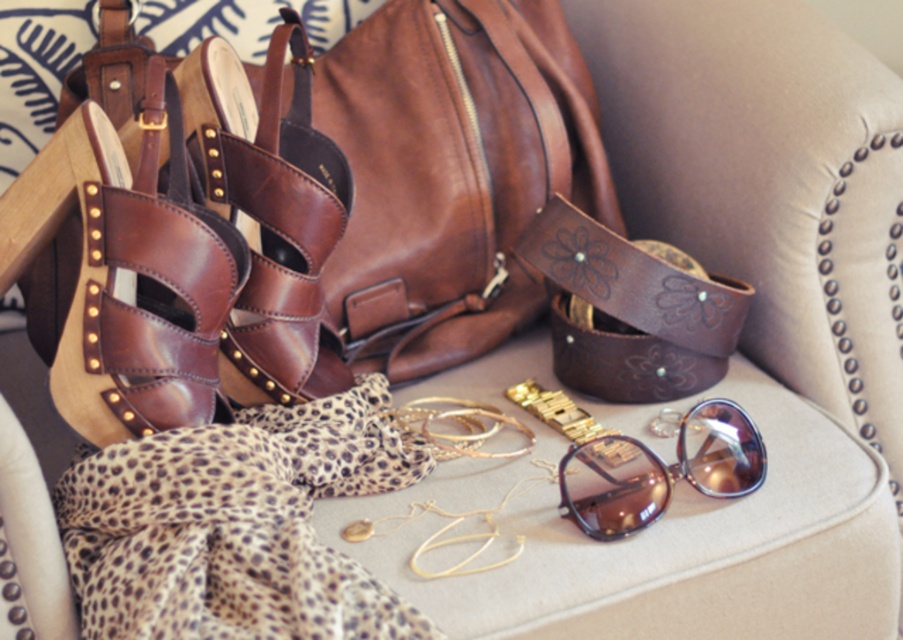
This screenshot has width=903, height=640. What are the coordinates of `brown leather bag at upper center` in the screenshot? It's located at (452, 172).

Can you confirm if brown leather bag at upper center is taller than brown leather sandal at left?

Correct, brown leather bag at upper center is much taller as brown leather sandal at left.

Locate an element on the screen. The image size is (903, 640). brown leather bag at upper center is located at coordinates (452, 172).

Which is above, brown leather sandal at left or shiny purple sunglasses at center?

brown leather sandal at left

Where is `brown leather sandal at left`? The image size is (903, 640). brown leather sandal at left is located at coordinates (281, 236).

Which is behind, point (321, 228) or point (729, 476)?

The point (321, 228) is more distant.

You are a GUI agent. You are given a task and a screenshot of the screen. Output one action in this format:
    pyautogui.click(x=<x>, y=<y>)
    Task: Click on the brown leather sandal at left
    The image size is (903, 640).
    Given the screenshot: What is the action you would take?
    [x=281, y=236]

Between point (132, 397) and point (686, 424), which one is positioned in front?

Point (132, 397) is in front.

Who is more forward, (182, 264) or (725, 484)?

Point (182, 264)

Identify the location of shiny brown leather sandal at left. The width and height of the screenshot is (903, 640). (155, 275).